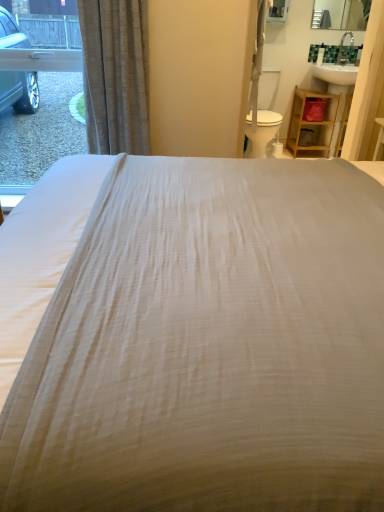
Question: Based on their positions, is clear glass window at left located to the left or right of white textured bed at center?

Choices:
 (A) right
 (B) left

Answer: (B)

Question: From the image's perspective, relative to white textured bed at center, is clear glass window at left above or below?

Choices:
 (A) above
 (B) below

Answer: (A)

Question: Which of these objects is positioned farthest from the silky beige curtain at left?

Choices:
 (A) wooden shelf at right
 (B) white plastic swivel chair at center-right
 (C) clear glass window at left
 (D) white textured bed at center

Answer: (A)

Question: Considering the real-world distances, which object is closest to the wooden shelf at right?

Choices:
 (A) white plastic swivel chair at center-right
 (B) silky beige curtain at left
 (C) white textured bed at center
 (D) clear glass window at left

Answer: (A)